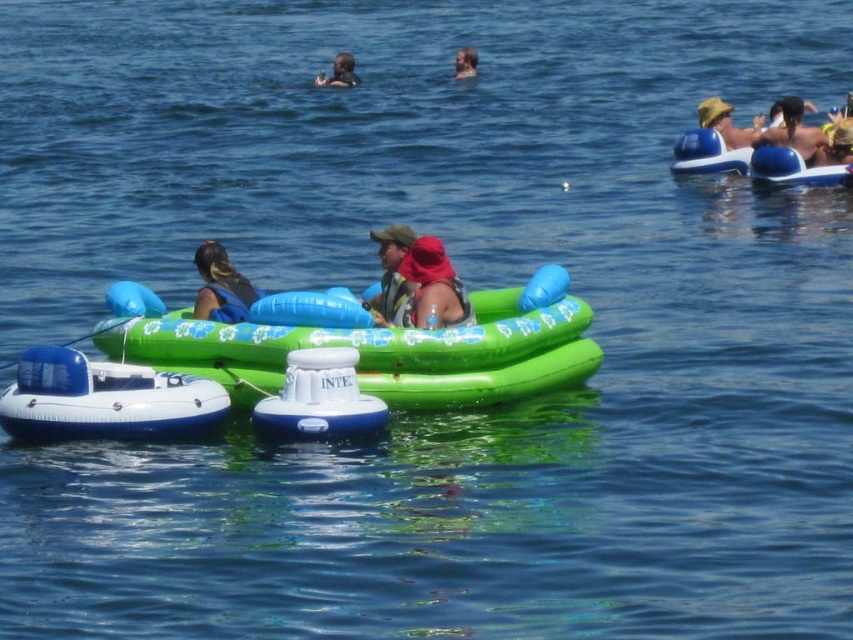
Question: Among these points, which one is nearest to the camera?

Choices:
 (A) (735, 145)
 (B) (461, 60)

Answer: (A)

Question: Is matte green float at center in front of smooth skin face at upper center?

Choices:
 (A) no
 (B) yes

Answer: (B)

Question: Does blue rubber raft at upper right have a greater width compared to yellow straw hat at upper right?

Choices:
 (A) no
 (B) yes

Answer: (B)

Question: Can you confirm if blue rubber boat at center is smaller than yellow fabric hat at upper right?

Choices:
 (A) no
 (B) yes

Answer: (A)

Question: Among these objects, which one is nearest to the camera?

Choices:
 (A) matte yellow hat at upper right
 (B) green inflatable raft at center
 (C) yellow straw hat at upper right
 (D) blue fabric life vest at left

Answer: (B)

Question: Which object is the farthest from the smooth skin at upper center?

Choices:
 (A) matte yellow hat at upper right
 (B) smooth skin face at upper center
 (C) blue rubber raft at upper right
 (D) red fabric headscarf at center

Answer: (D)